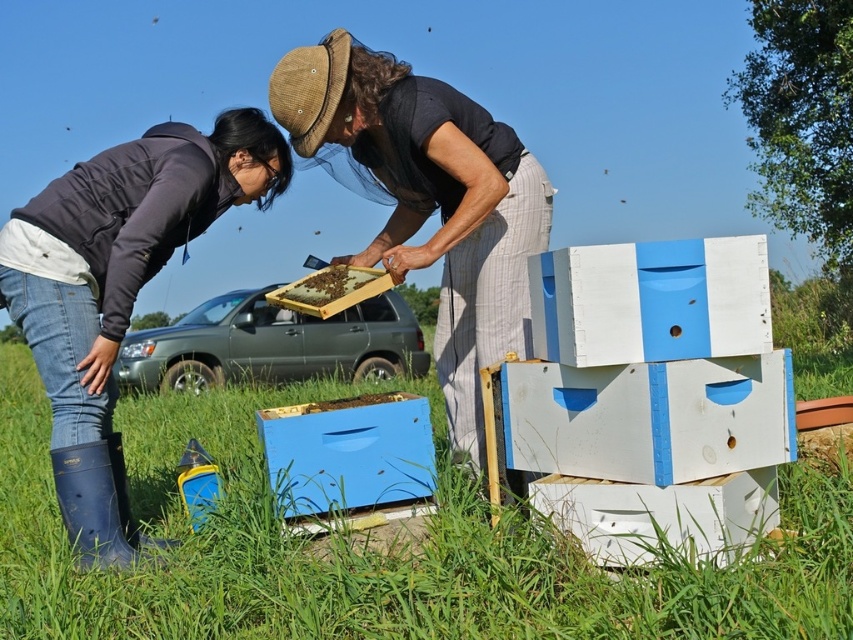
Question: Which object is positioned closest to the dark gray jacket at lower left?

Choices:
 (A) blue painted wooden beehive at lower center
 (B) wooden frame at center

Answer: (B)

Question: Is blue painted wooden beehive at lower center bigger than wooden frame at center?

Choices:
 (A) no
 (B) yes

Answer: (B)

Question: Does dark gray jacket at lower left have a greater width compared to matte black shirt at center?

Choices:
 (A) no
 (B) yes

Answer: (A)

Question: Which point is farther to the camera?

Choices:
 (A) (412, 264)
 (B) (109, 376)
 (C) (326, 278)
 (D) (376, 464)

Answer: (C)

Question: Can you confirm if dark gray jacket at lower left is positioned to the right of wooden frame at center?

Choices:
 (A) yes
 (B) no

Answer: (B)

Question: Which object is positioned farthest from the dark gray jacket at lower left?

Choices:
 (A) blue painted wooden beehive at lower center
 (B) matte black shirt at center
 (C) wooden frame at center

Answer: (A)